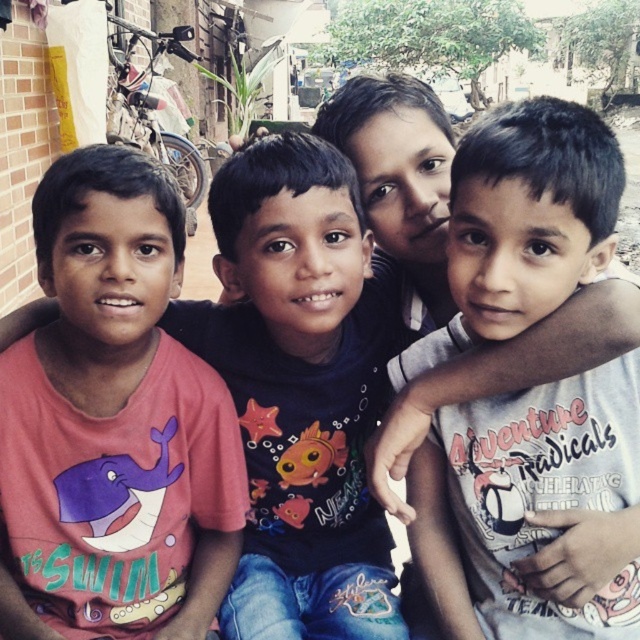
Question: Is the position of white matte shirt at center more distant than that of pink matte t-shirt at left?

Choices:
 (A) no
 (B) yes

Answer: (A)

Question: Which object is closer to the camera taking this photo?

Choices:
 (A) white matte shirt at center
 (B) pink matte t-shirt at left

Answer: (A)

Question: Which of the following is the farthest from the observer?

Choices:
 (A) (92, 328)
 (B) (608, 141)

Answer: (A)

Question: Can you confirm if white matte shirt at center is positioned above pink matte t-shirt at left?

Choices:
 (A) yes
 (B) no

Answer: (A)

Question: Can you confirm if white matte shirt at center is positioned above pink matte t-shirt at left?

Choices:
 (A) no
 (B) yes

Answer: (B)